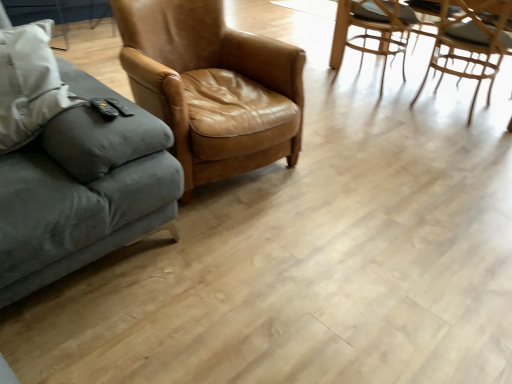
Question: In the image, is brown leather chair at center, the 1th chair positioned from the left, on the left side or the right side of light brown woven chair at upper right, the 2th chair viewed from the right?

Choices:
 (A) left
 (B) right

Answer: (A)

Question: Based on their sizes in the image, would you say brown leather chair at center, the 3th chair in the right-to-left sequence, is bigger or smaller than light brown woven chair at upper right, positioned as the 2th chair in left-to-right order?

Choices:
 (A) big
 (B) small

Answer: (A)

Question: Which object is positioned farthest from the light brown woven chair at upper right, which is counted as the first chair, starting from the right?

Choices:
 (A) light brown woven chair at upper right, the 2th chair viewed from the right
 (B) brown leather chair at center, the 3th chair in the right-to-left sequence
 (C) velvet gray couch at left

Answer: (C)

Question: Which object is positioned closest to the light brown woven chair at upper right, positioned as the 2th chair in left-to-right order?

Choices:
 (A) light brown woven chair at upper right, which is counted as the first chair, starting from the right
 (B) brown leather chair at center, the 3th chair in the right-to-left sequence
 (C) velvet gray couch at left

Answer: (A)